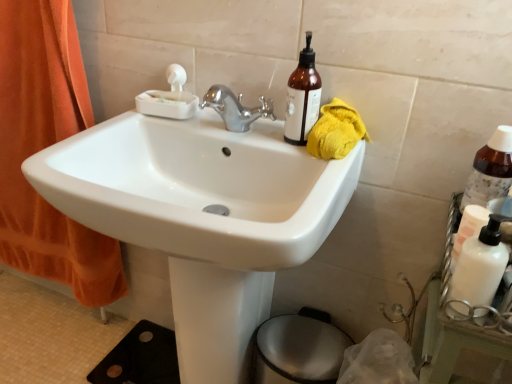
Question: Do you think translucent amber bottle at upper right, the second bottle from the bottom, is within metallic silver bidet at lower center, or outside of it?

Choices:
 (A) inside
 (B) outside

Answer: (B)

Question: Is translucent amber bottle at upper right, the first bottle in the top-to-bottom sequence, bigger or smaller than metallic silver bidet at lower center?

Choices:
 (A) big
 (B) small

Answer: (B)

Question: Which of these objects is positioned farthest from the white matte bottle at right?

Choices:
 (A) white glossy sink at center
 (B) yellow cloth at upper right
 (C) metallic silver bidet at lower center
 (D) translucent amber bottle at upper right, the second bottle positioned from the right
 (E) translucent amber bottle at right, acting as the 2th bottle starting from the top

Answer: (C)

Question: Which is nearer to the translucent amber bottle at right, acting as the 2th bottle starting from the top?

Choices:
 (A) white matte bottle at right
 (B) translucent amber bottle at upper right, marked as the 1th bottle in a left-to-right arrangement
 (C) orange fabric curtain at left
 (D) yellow cloth at upper right
 (E) metallic silver bidet at lower center

Answer: (A)